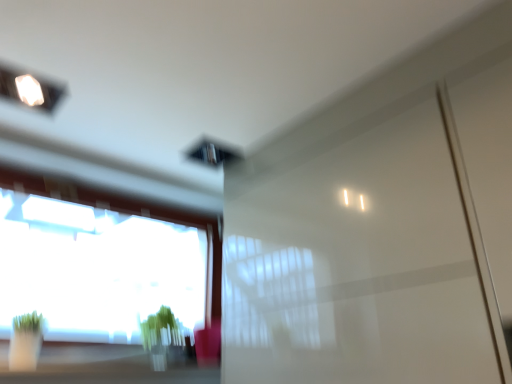
Question: Considering the relative sizes of transparent glass window at lower left and glossy white screen door at center in the image provided, is transparent glass window at lower left thinner than glossy white screen door at center?

Choices:
 (A) no
 (B) yes

Answer: (B)

Question: Is transparent glass window at lower left at the left side of glossy white screen door at center?

Choices:
 (A) no
 (B) yes

Answer: (B)

Question: Is the surface of transparent glass window at lower left in direct contact with glossy white screen door at center?

Choices:
 (A) no
 (B) yes

Answer: (A)

Question: Is transparent glass window at lower left outside of glossy white screen door at center?

Choices:
 (A) yes
 (B) no

Answer: (A)

Question: Is transparent glass window at lower left shorter than glossy white screen door at center?

Choices:
 (A) yes
 (B) no

Answer: (A)

Question: Does transparent glass window at lower left have a larger size compared to glossy white screen door at center?

Choices:
 (A) yes
 (B) no

Answer: (B)

Question: Considering the relative positions of glossy white screen door at center and transparent glass window at lower left in the image provided, is glossy white screen door at center to the left of transparent glass window at lower left from the viewer's perspective?

Choices:
 (A) no
 (B) yes

Answer: (A)

Question: Does glossy white screen door at center have a lesser width compared to transparent glass window at lower left?

Choices:
 (A) yes
 (B) no

Answer: (B)

Question: Does glossy white screen door at center lie behind transparent glass window at lower left?

Choices:
 (A) no
 (B) yes

Answer: (A)

Question: Can you confirm if glossy white screen door at center is smaller than transparent glass window at lower left?

Choices:
 (A) yes
 (B) no

Answer: (B)

Question: Is the surface of glossy white screen door at center in direct contact with transparent glass window at lower left?

Choices:
 (A) yes
 (B) no

Answer: (B)

Question: Does glossy white screen door at center have a larger size compared to transparent glass window at lower left?

Choices:
 (A) yes
 (B) no

Answer: (A)

Question: Does glossy white screen door at center come behind green matte plant at lower center?

Choices:
 (A) no
 (B) yes

Answer: (A)